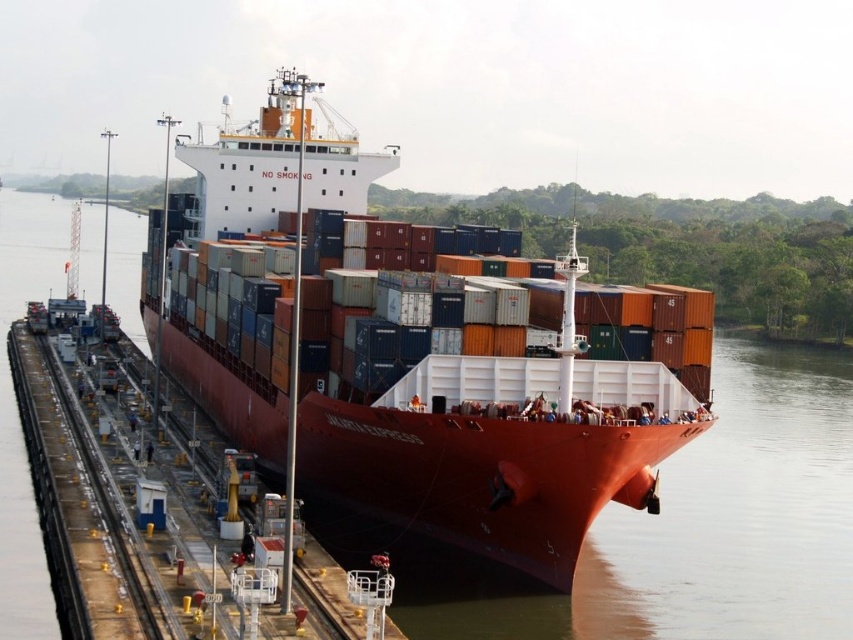
You are a crane operator tasked with loading containers onto the matte red container ship at center and the orange matte container ship at center. Which ship requires a taller crane to load containers onto its highest deck?

The matte red container ship at center requires a taller crane because it is much taller than the orange matte container ship at center.

You are a crane operator tasked with moving containers between the matte red container ship at center and the orange matte container ship at center. The crane has a maximum reach of 5 feet. Can you transfer containers between them without moving the crane?

The distance between the matte red container ship at center and the orange matte container ship at center is 4.60 feet, which is within the crane operator maximum reach of 5 feet. Therefore, the crane can transfer containers between them without moving.